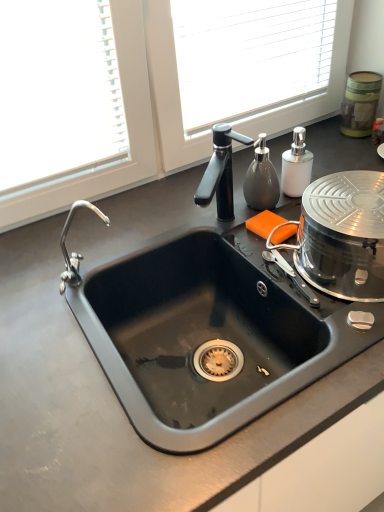
Question: Could you tell me if black matte sink at center is turned towards white matte soap dispenser at upper right?

Choices:
 (A) yes
 (B) no

Answer: (B)

Question: From a real-world perspective, is black matte sink at center on white matte soap dispenser at upper right?

Choices:
 (A) yes
 (B) no

Answer: (B)

Question: Does black matte sink at center contain white matte soap dispenser at upper right?

Choices:
 (A) yes
 (B) no

Answer: (B)

Question: Can you confirm if black matte sink at center is smaller than white matte soap dispenser at upper right?

Choices:
 (A) no
 (B) yes

Answer: (A)

Question: Does black matte sink at center appear on the right side of white matte soap dispenser at upper right?

Choices:
 (A) no
 (B) yes

Answer: (A)

Question: Is point (296, 195) positioned closer to the camera than point (140, 261)?

Choices:
 (A) farther
 (B) closer

Answer: (A)

Question: From a real-world perspective, is white matte soap dispenser at upper right above or below black matte sink at center?

Choices:
 (A) above
 (B) below

Answer: (A)

Question: Based on their sizes in the image, would you say white matte soap dispenser at upper right is bigger or smaller than black matte sink at center?

Choices:
 (A) small
 (B) big

Answer: (A)

Question: Based on their positions, is white matte soap dispenser at upper right located to the left or right of black matte sink at center?

Choices:
 (A) right
 (B) left

Answer: (A)

Question: From the image's perspective, relative to black matte sink at center, is green textured canister at upper right, the first appliance in the back-to-front sequence, above or below?

Choices:
 (A) above
 (B) below

Answer: (A)

Question: Looking at their shapes, would you say green textured canister at upper right, which is the first appliance in top-to-bottom order, is wider or thinner than black matte sink at center?

Choices:
 (A) thin
 (B) wide

Answer: (A)

Question: In the image, is green textured canister at upper right, acting as the 2th appliance starting from the bottom, positioned in front of or behind black matte sink at center?

Choices:
 (A) front
 (B) behind

Answer: (B)

Question: From a real-world perspective, is green textured canister at upper right, which is the first appliance in top-to-bottom order, positioned above or below black matte sink at center?

Choices:
 (A) below
 (B) above

Answer: (B)

Question: Is point (362, 81) positioned closer to the camera than point (352, 231)?

Choices:
 (A) closer
 (B) farther

Answer: (B)

Question: Considering the positions of green textured canister at upper right, which is the first appliance in top-to-bottom order, and shiny metallic steamer at right, which appears as the second appliance when viewed from the back, in the image, is green textured canister at upper right, which is the first appliance in top-to-bottom order, bigger or smaller than shiny metallic steamer at right, which appears as the second appliance when viewed from the back,?

Choices:
 (A) small
 (B) big

Answer: (A)